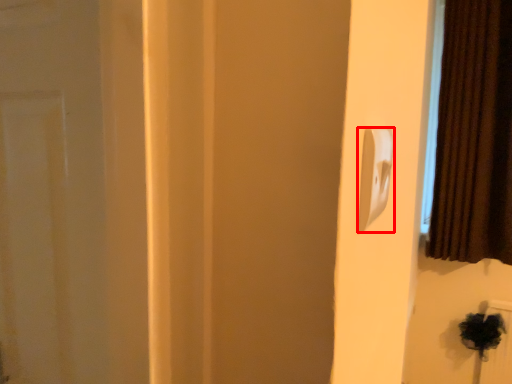
Question: Where is light switch (annotated by the red box) located in relation to curtain in the image?

Choices:
 (A) right
 (B) left

Answer: (B)